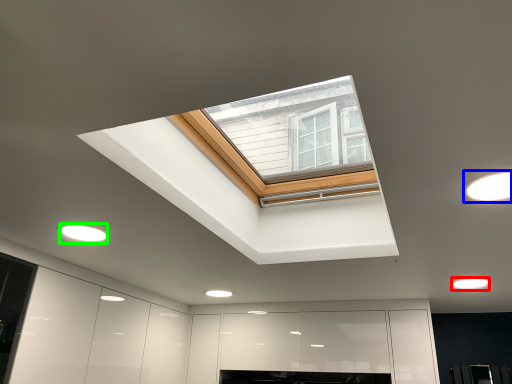
Question: Based on their relative distances, which object is nearer to lighting (highlighted by a red box)? Choose from lighting (highlighted by a blue box) and lighting (highlighted by a green box).

Choices:
 (A) lighting
 (B) lighting

Answer: (A)